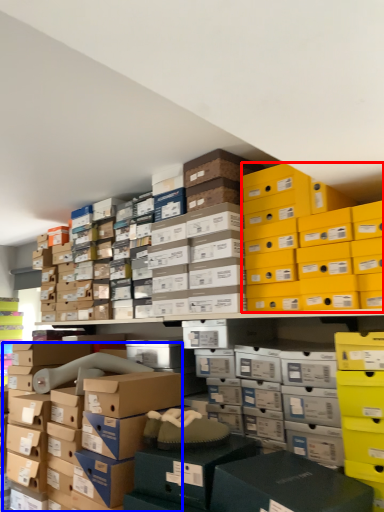
Question: Among these objects, which one is nearest to the camera, storage box (highlighted by a red box) or storage box (highlighted by a blue box)?

Choices:
 (A) storage box
 (B) storage box

Answer: (A)